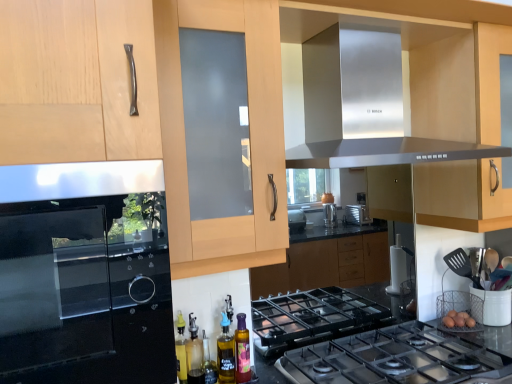
The image size is (512, 384). What do you see at coordinates (141, 106) in the screenshot?
I see `matte wood cabinet at center` at bounding box center [141, 106].

This screenshot has height=384, width=512. In order to click on satin black oven at left in this screenshot , I will do `click(85, 274)`.

Which is further, (82, 282) or (462, 148)?

The point (462, 148) is farther.

Can you confirm if satin black oven at left is positioned to the right of stainless steel exhaust hood at upper center?

In fact, satin black oven at left is to the left of stainless steel exhaust hood at upper center.

Measure the distance from satin black oven at left to stainless steel exhaust hood at upper center.

satin black oven at left is 32.92 inches away from stainless steel exhaust hood at upper center.

How different are the orientations of satin black oven at left and stainless steel exhaust hood at upper center in degrees?

3.89e-05 degrees.

Consider the image. Considering the sizes of stainless steel exhaust hood at upper center and polished stainless steel gas stove at center in the image, is stainless steel exhaust hood at upper center wider or thinner than polished stainless steel gas stove at center?

In the image, stainless steel exhaust hood at upper center appears to be more narrow than polished stainless steel gas stove at center.

Looking at this image, from a real-world perspective, is stainless steel exhaust hood at upper center physically located above or below polished stainless steel gas stove at center?

In terms of real-world spatial position, stainless steel exhaust hood at upper center is above polished stainless steel gas stove at center.

Identify the location of exhaust hood in front of the polished stainless steel gas stove at center. This screenshot has width=512, height=384. (351, 120).

Is polished stainless steel gas stove at center far from satin black oven at left?

No, polished stainless steel gas stove at center is not far away from satin black oven at left.

From a real-world perspective, between polished stainless steel gas stove at center and satin black oven at left, who is vertically lower?

polished stainless steel gas stove at center, from a real-world perspective.

Based on the photo, how different are the orientations of polished stainless steel gas stove at center and satin black oven at left in degrees?

The angular difference between polished stainless steel gas stove at center and satin black oven at left is 2.01e-05 degrees.

Is polished stainless steel gas stove at center aimed at satin black oven at left?

No, polished stainless steel gas stove at center is not turned towards satin black oven at left.

Can you see matte wood cabinet at center touching stainless steel exhaust hood at upper center?

No.

Can you confirm if matte wood cabinet at center is taller than stainless steel exhaust hood at upper center?

Correct, matte wood cabinet at center is much taller as stainless steel exhaust hood at upper center.

Can you confirm if matte wood cabinet at center is smaller than stainless steel exhaust hood at upper center?

No, matte wood cabinet at center is not smaller than stainless steel exhaust hood at upper center.

From the image's perspective, relative to stainless steel exhaust hood at upper center, is matte wood cabinet at center above or below?

Based on their image positions, matte wood cabinet at center is located beneath stainless steel exhaust hood at upper center.

From the image's perspective, does satin black oven at left appear higher than matte wood cabinet at center?

No, from the image's perspective, satin black oven at left is not above matte wood cabinet at center.

Which object is positioned more to the right, satin black oven at left or matte wood cabinet at center?

matte wood cabinet at center.

Is satin black oven at left bigger or smaller than matte wood cabinet at center?

In the image, satin black oven at left appears to be smaller than matte wood cabinet at center.

Does satin black oven at left have a greater height compared to matte wood cabinet at center?

Incorrect, the height of satin black oven at left is not larger of that of matte wood cabinet at center.

Identify the location of bottle below the stainless steel exhaust hood at upper center (from the image's perspective). This screenshot has height=384, width=512. (242, 351).

Would you say stainless steel exhaust hood at upper center is outside translucent glass bottle at lower center?

stainless steel exhaust hood at upper center lies outside translucent glass bottle at lower center's area.

Can you confirm if stainless steel exhaust hood at upper center is positioned to the right of translucent glass bottle at lower center?

Yes.

From the image's perspective, relative to translucent glass bottle at lower center, is stainless steel exhaust hood at upper center above or below?

stainless steel exhaust hood at upper center is above translucent glass bottle at lower center.

Which is behind, translucent glass bottle at lower center or stainless steel exhaust hood at upper center?

translucent glass bottle at lower center is further from the camera.

Find the location of a particular element. This screenshot has width=512, height=384. exhaust hood in front of the translucent glass bottle at lower center is located at coordinates (351, 120).

Between translucent glass bottle at lower center and stainless steel exhaust hood at upper center, which one has larger size?

With larger size is stainless steel exhaust hood at upper center.

Find the location of a particular element. Image resolution: width=512 pixels, height=384 pixels. exhaust hood located above the satin black oven at left (from the image's perspective) is located at coordinates (351, 120).

I want to click on exhaust hood lying in front of the polished stainless steel gas stove at center, so click(351, 120).

When comparing their distances from stainless steel exhaust hood at upper center, does translucent glass bottle at lower center or satin black oven at left seem closer?

satin black oven at left.

Which object lies nearer to the anchor point satin black oven at left, translucent glass bottle at lower center or stainless steel exhaust hood at upper center?

The object closer to satin black oven at left is translucent glass bottle at lower center.

Estimate the real-world distances between objects in this image. Which object is closer to polished stainless steel gas stove at center, stainless steel exhaust hood at upper center or matte wood cabinet at center?

matte wood cabinet at center.

From the image, which object appears to be nearer to translucent glass bottle at lower center, matte wood cabinet at center or stainless steel exhaust hood at upper center?

The object closer to translucent glass bottle at lower center is stainless steel exhaust hood at upper center.

Based on their spatial positions, is matte wood cabinet at center or translucent glass bottle at lower center closer to stainless steel exhaust hood at upper center?

matte wood cabinet at center.

Considering their positions, is translucent glass bottle at lower center positioned further to matte wood cabinet at center than stainless steel exhaust hood at upper center?

translucent glass bottle at lower center is positioned further to the anchor matte wood cabinet at center.

Based on their spatial positions, is polished stainless steel gas stove at center or matte wood cabinet at center closer to stainless steel exhaust hood at upper center?

Among the two, matte wood cabinet at center is located nearer to stainless steel exhaust hood at upper center.

When comparing their distances from stainless steel exhaust hood at upper center, does satin black oven at left or translucent glass bottle at lower center seem further?

translucent glass bottle at lower center is further to stainless steel exhaust hood at upper center.

The height and width of the screenshot is (384, 512). Identify the location of exhaust hood between satin black oven at left and polished stainless steel gas stove at center. (351, 120).

This screenshot has width=512, height=384. I want to click on bottle between satin black oven at left and matte wood cabinet at center in the horizontal direction, so click(242, 351).

This screenshot has width=512, height=384. In order to click on exhaust hood located between satin black oven at left and matte wood cabinet at center in the left-right direction in this screenshot , I will do `click(351, 120)`.

At what (x,y) coordinates should I click in order to perform the action: click on bottle between satin black oven at left and stainless steel exhaust hood at upper center. Please return your answer as a coordinate pair (x, y). Looking at the image, I should click on (242, 351).